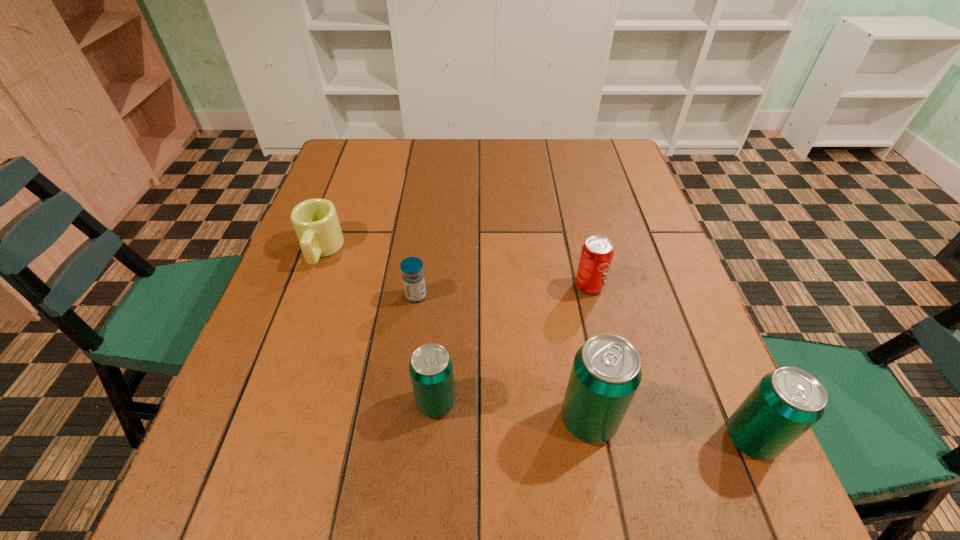
Where is `vacant region located on the left of the second beer can from left to right`? vacant region located on the left of the second beer can from left to right is located at coordinates (434, 420).

Find the location of a particular element. vacant area located on the back of the rightmost beer can is located at coordinates (694, 310).

What are the coordinates of `free space located 0.170m on the front of the soda` in the screenshot? It's located at (607, 363).

The width and height of the screenshot is (960, 540). I want to click on free spot located 0.170m with the handle on the side of the leftmost object, so click(x=292, y=330).

This screenshot has width=960, height=540. In order to click on vacant space located on the back of the medicine in this screenshot , I will do `click(425, 230)`.

This screenshot has width=960, height=540. I want to click on object at the left edge, so click(315, 221).

What are the coordinates of `object present at the right edge` in the screenshot? It's located at (785, 403).

You are a GUI agent. You are given a task and a screenshot of the screen. Output one action in this format:
    pyautogui.click(x=<x>, y=<y>)
    Task: Click on the object situated at the near right corner
    Image resolution: width=960 pixels, height=540 pixels.
    Given the screenshot: What is the action you would take?
    pyautogui.click(x=785, y=403)

At what (x,y) coordinates should I click in order to perform the action: click on free space at the far edge. Please return your answer as a coordinate pair (x, y). Looking at the image, I should click on (411, 174).

What are the coordinates of `vacant region at the near edge` in the screenshot? It's located at (366, 427).